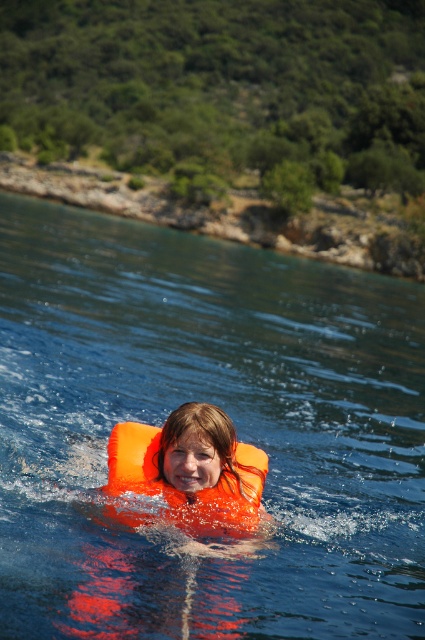
You are a lifeguard on duty and need to locate the transparent orange life vest at center and the orange inflatable at center. Based on their positions in the water, which one is closer to you?

The transparent orange life vest at center is closer to you because it is positioned in front of the orange inflatable at center.

You are a lifeguard on duty and see a swimmer wearing a transparent orange life vest at center and an orange inflatable at center. Which object is taller?

The transparent orange life vest at center is much taller than the orange inflatable at center.